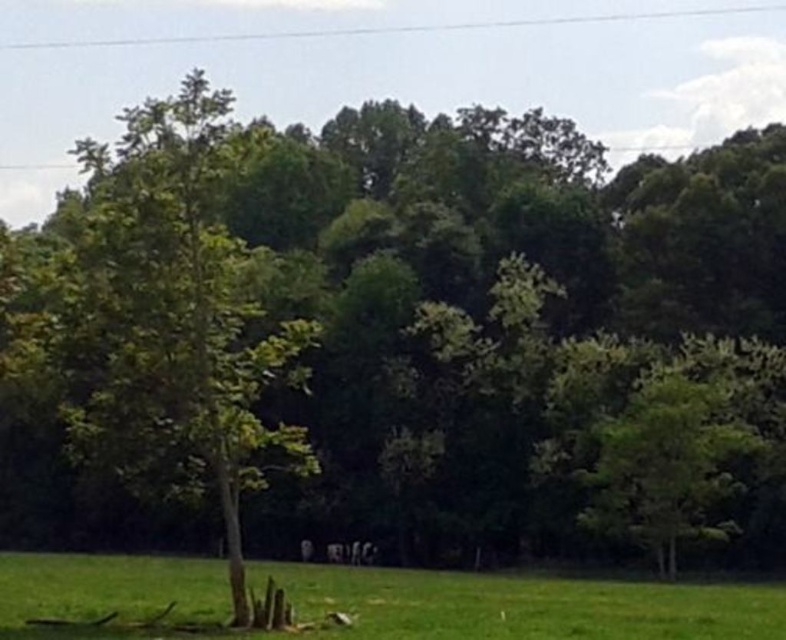
Based on the photo, you are standing in the outdoor scene and want to walk towards the green leafy tree at right. Which direction should you move relative to the green grass at lower center?

To reach the green leafy tree at right, you should move away from the green grass at lower center since the green grass at lower center is closer to the viewer than the green leafy tree at right.

You are standing in the middle of the forest in the image. You want to walk to the green grass at lower center. Which direction should you move relative to your current position?

You should move towards the lower center direction to reach the green grass at lower center.